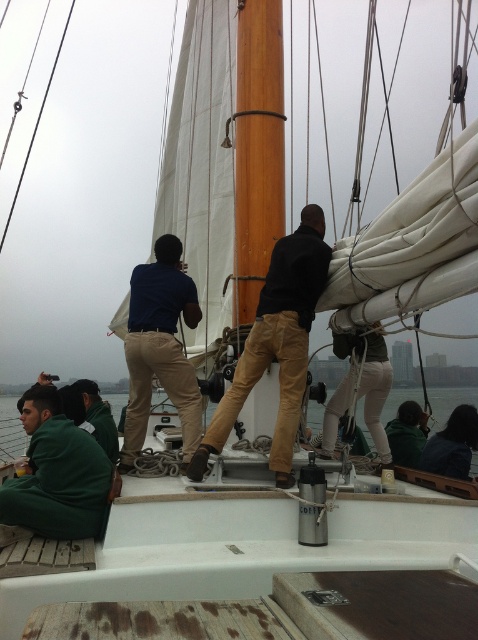
Question: Estimate the real-world distances between objects in this image. Which object is farther from the dark brown leather pants at center?

Choices:
 (A) matte blue shirt at center
 (B) wooden mast at center
 (C) green fleece jacket at lower left

Answer: (C)

Question: Which point appears farthest from the camera in this image?

Choices:
 (A) (14, 513)
 (B) (249, 51)
 (C) (151, 332)
 (D) (267, 348)

Answer: (B)

Question: Which object is closer to the camera taking this photo?

Choices:
 (A) matte blue shirt at center
 (B) dark brown leather pants at center
 (C) wooden mast at center

Answer: (B)

Question: Is dark brown leather pants at center behind matte blue shirt at center?

Choices:
 (A) yes
 (B) no

Answer: (B)

Question: Observing the image, what is the correct spatial positioning of wooden mast at center in reference to matte blue shirt at center?

Choices:
 (A) below
 (B) above

Answer: (B)

Question: From the image, what is the correct spatial relationship of dark brown leather pants at center in relation to wooden mast at center?

Choices:
 (A) above
 (B) below

Answer: (B)